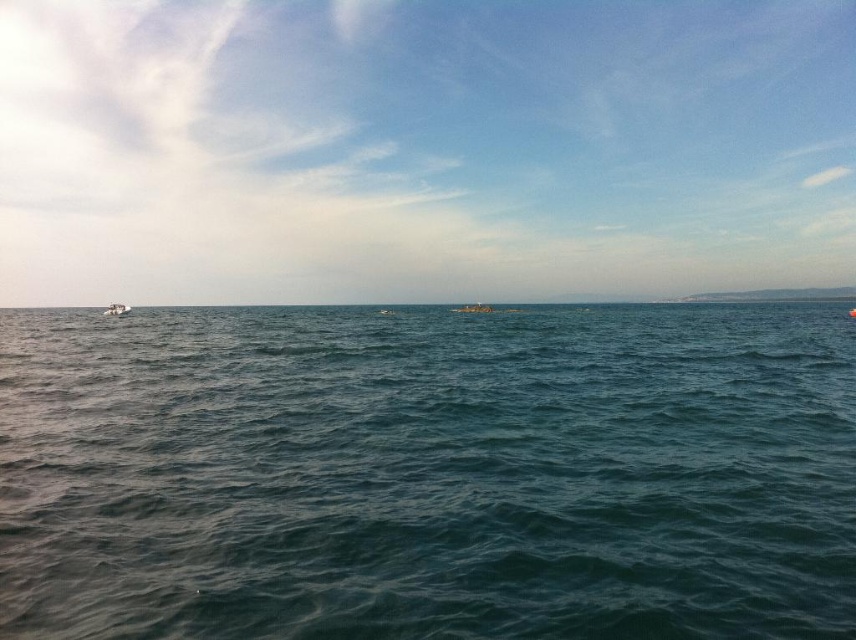
You are a photographer planning to take a photo of the metallic silver boat at center and the white plastic boat at left. If you want to make sure both boats are clearly visible in the frame, which boat should you focus on first to ensure proper focus, considering their sizes?

The metallic silver boat at center is bigger than the white plastic boat at left, so you should focus on the metallic silver boat at center first to ensure it is clearly visible, and then adjust focus for the smaller boat.

You are a sailor who wants to know which boat is closer to the horizon. Based on the scene, which boat is positioned closer to the horizon between the metallic silver boat at center and the white plastic boat at left?

The metallic silver boat at center is positioned over the white plastic boat at left, meaning it is closer to the horizon.

You are a sailor navigating a metallic silver boat at center. You need to anchor your boat at point (473, 308). Is your current position correct?

Yes, the metallic silver boat at center is already located at point (473, 308), so the current position is correct.